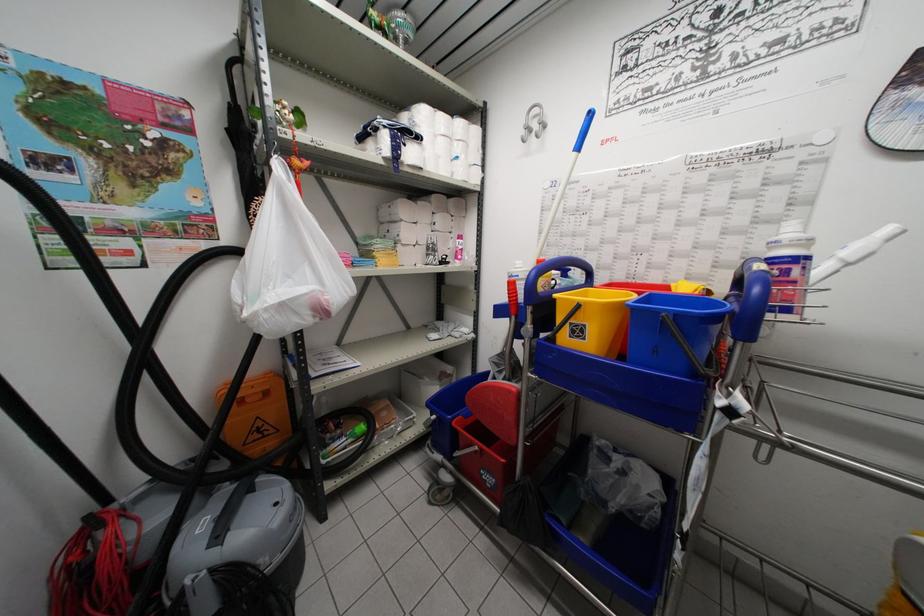
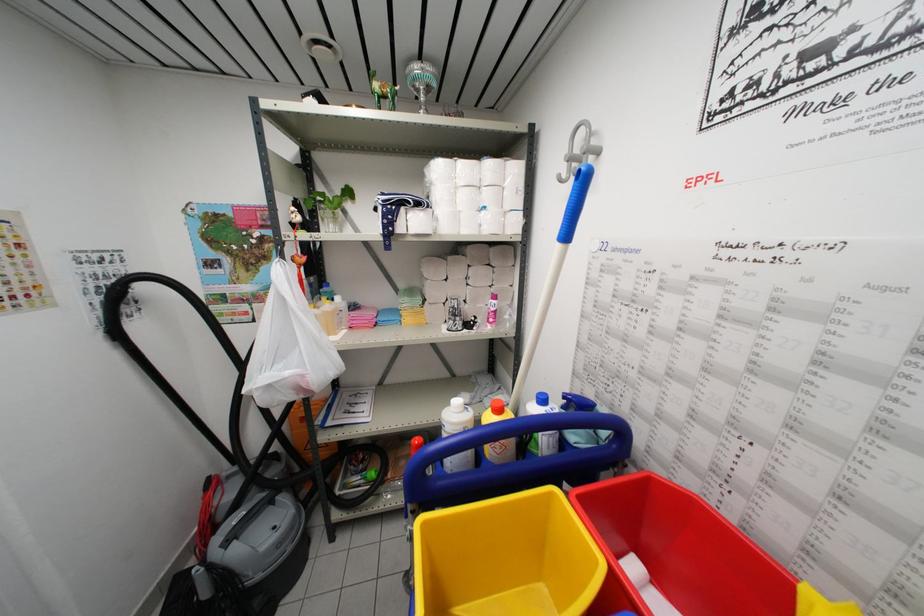
Question: The images are taken continuously from a first-person perspective. In which direction is your viewpoint rotating?

Choices:
 (A) Left
 (B) Right
 (C) Up
 (D) Down

Answer: (A)